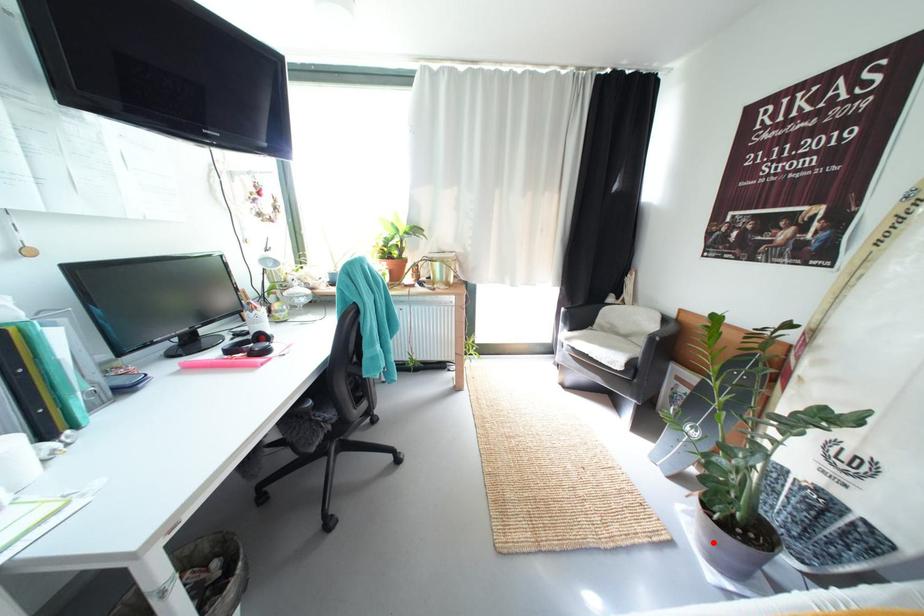
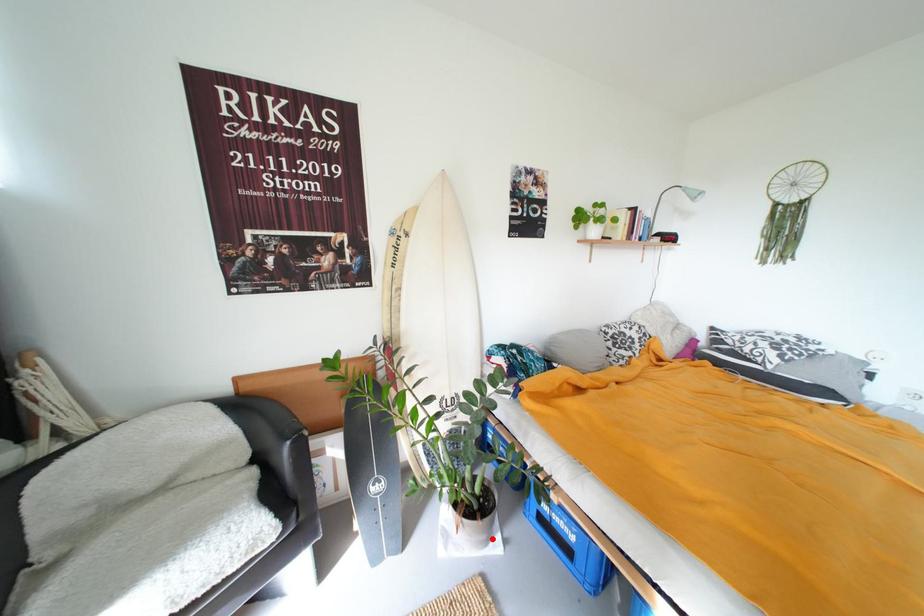
I am providing you with two images of the same scene from different viewpoints. A red point is marked on the first image and another point is marked on the second image. Do the highlighted points in image1 and image2 indicate the same real-world spot?

Yes